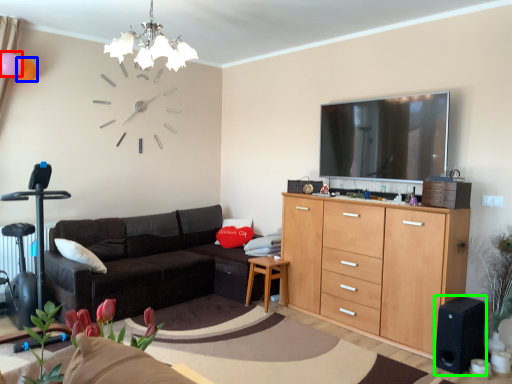
Question: Considering the real-world distances, which object is closest to balloon (highlighted by a red box)? balloon (highlighted by a blue box) or speaker (highlighted by a green box).

Choices:
 (A) balloon
 (B) speaker

Answer: (A)